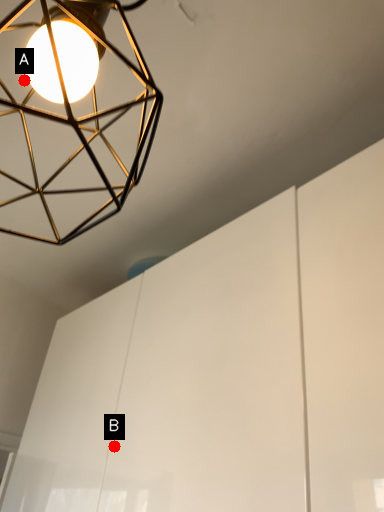
Question: Two points are circled on the image, labeled by A and B beside each circle. Which point appears farthest from the camera in this image?

Choices:
 (A) A is further
 (B) B is further

Answer: (B)